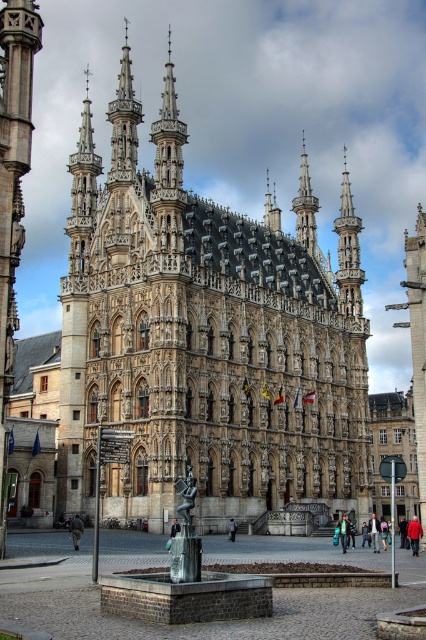
Question: Is stone gothic church at center positioned in front of brick fountain at center?

Choices:
 (A) yes
 (B) no

Answer: (B)

Question: Does stone gothic church at center appear under brick fountain at center?

Choices:
 (A) yes
 (B) no

Answer: (B)

Question: Which point is farther to the camera?

Choices:
 (A) click(319, 550)
 (B) click(112, 204)

Answer: (B)

Question: Can you confirm if stone gothic church at center is positioned above brick fountain at center?

Choices:
 (A) no
 (B) yes

Answer: (B)

Question: Which point is farther to the camera?

Choices:
 (A) brick fountain at center
 (B) stone gothic church at center

Answer: (B)